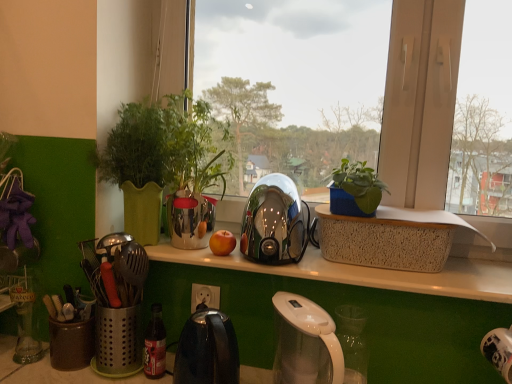
Question: Does metallic silver kettle at center contain white translucent coffee maker at lower center?

Choices:
 (A) no
 (B) yes

Answer: (A)

Question: Is metallic silver kettle at center in contact with white translucent coffee maker at lower center?

Choices:
 (A) no
 (B) yes

Answer: (A)

Question: From a real-world perspective, is metallic silver kettle at center located beneath white translucent coffee maker at lower center?

Choices:
 (A) yes
 (B) no

Answer: (B)

Question: Considering the relative sizes of metallic silver kettle at center and white translucent coffee maker at lower center in the image provided, is metallic silver kettle at center shorter than white translucent coffee maker at lower center?

Choices:
 (A) yes
 (B) no

Answer: (B)

Question: Is metallic silver kettle at center closer to camera compared to white translucent coffee maker at lower center?

Choices:
 (A) yes
 (B) no

Answer: (B)

Question: From the image's perspective, is metallic silver kettle at center under white translucent coffee maker at lower center?

Choices:
 (A) yes
 (B) no

Answer: (B)

Question: Considering the relative sizes of white translucent coffee maker at lower center and white glossy power outlet at center in the image provided, is white translucent coffee maker at lower center taller than white glossy power outlet at center?

Choices:
 (A) yes
 (B) no

Answer: (A)

Question: Does white translucent coffee maker at lower center have a larger size compared to white glossy power outlet at center?

Choices:
 (A) yes
 (B) no

Answer: (A)

Question: Is white translucent coffee maker at lower center not near white glossy power outlet at center?

Choices:
 (A) yes
 (B) no

Answer: (B)

Question: Considering the relative sizes of white translucent coffee maker at lower center and white glossy power outlet at center in the image provided, is white translucent coffee maker at lower center smaller than white glossy power outlet at center?

Choices:
 (A) yes
 (B) no

Answer: (B)

Question: Considering the relative positions of white translucent coffee maker at lower center and white glossy power outlet at center in the image provided, is white translucent coffee maker at lower center to the right of white glossy power outlet at center from the viewer's perspective?

Choices:
 (A) yes
 (B) no

Answer: (A)

Question: Can white glossy power outlet at center be found inside white translucent coffee maker at lower center?

Choices:
 (A) no
 (B) yes

Answer: (A)

Question: Is shiny metallic kettle at center, placed as the 1th kettle when sorted from top to bottom, closer to the viewer compared to metallic silver kettle at center?

Choices:
 (A) yes
 (B) no

Answer: (A)